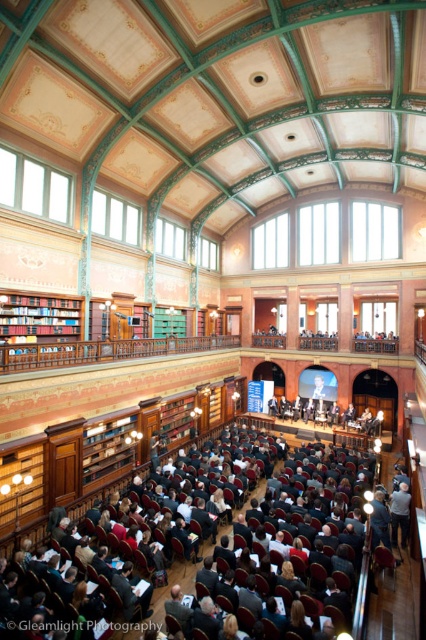
How much distance is there between dark gray suit at center and wooden bookshelf at left?

dark gray suit at center is 8.76 meters away from wooden bookshelf at left.

Who is more distant from viewer, (172, 515) or (60, 298)?

The point (60, 298) is more distant.

I want to click on dark gray suit at center, so click(x=181, y=566).